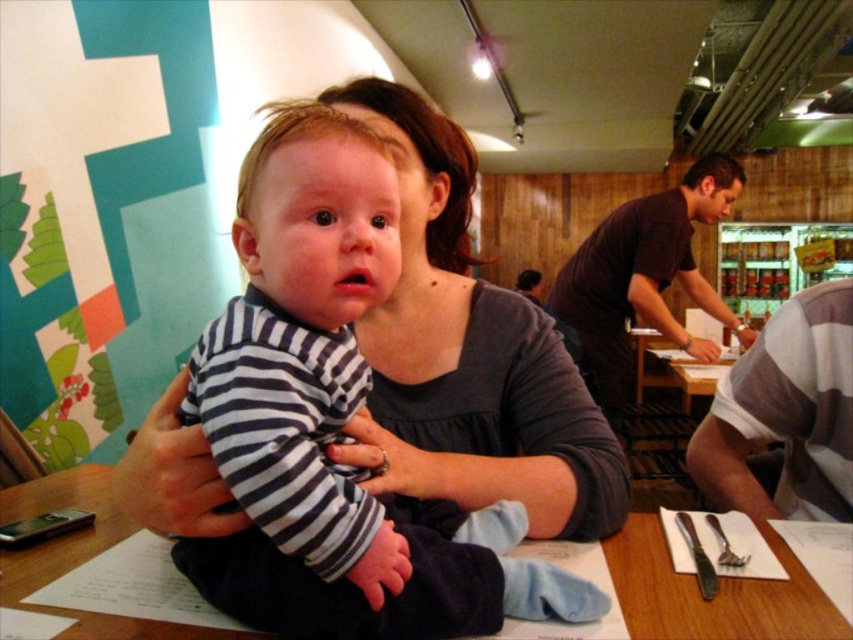
Question: Is gray striped shirt at lower right smaller than dark brown shirt at center?

Choices:
 (A) yes
 (B) no

Answer: (A)

Question: Which of these objects is positioned closest to the striped cotton shirt at center?

Choices:
 (A) gray striped shirt at lower right
 (B) wooden table at center
 (C) dark brown shirt at center

Answer: (B)

Question: Which is farther from the dark brown shirt at center?

Choices:
 (A) gray striped shirt at lower right
 (B) striped cotton shirt at center

Answer: (B)

Question: Which object is farther from the camera taking this photo?

Choices:
 (A) dark brown shirt at center
 (B) wooden table at center
 (C) gray striped shirt at lower right

Answer: (A)

Question: Is striped cotton shirt at center further to the viewer compared to gray striped shirt at lower right?

Choices:
 (A) yes
 (B) no

Answer: (B)

Question: Does wooden table at center have a lesser width compared to gray striped shirt at lower right?

Choices:
 (A) no
 (B) yes

Answer: (A)